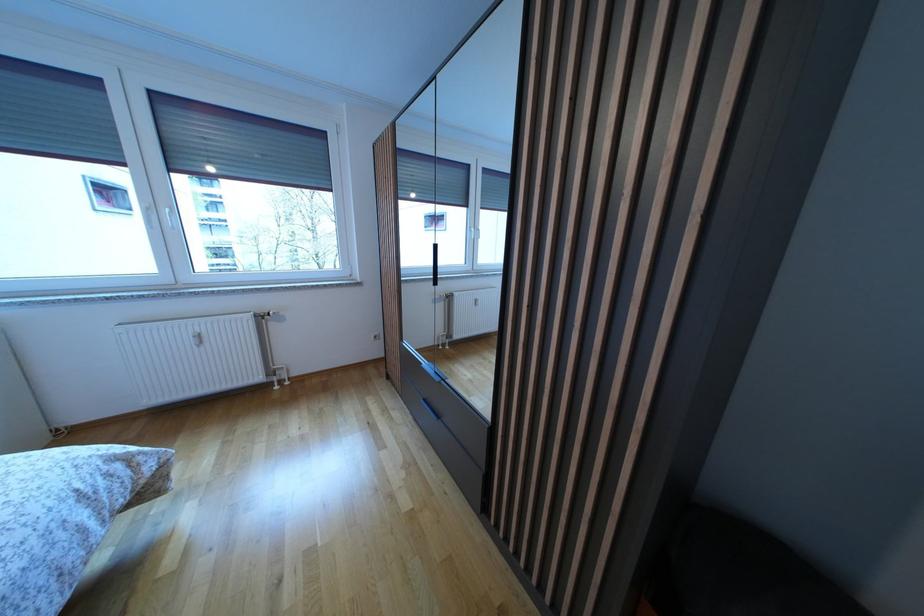
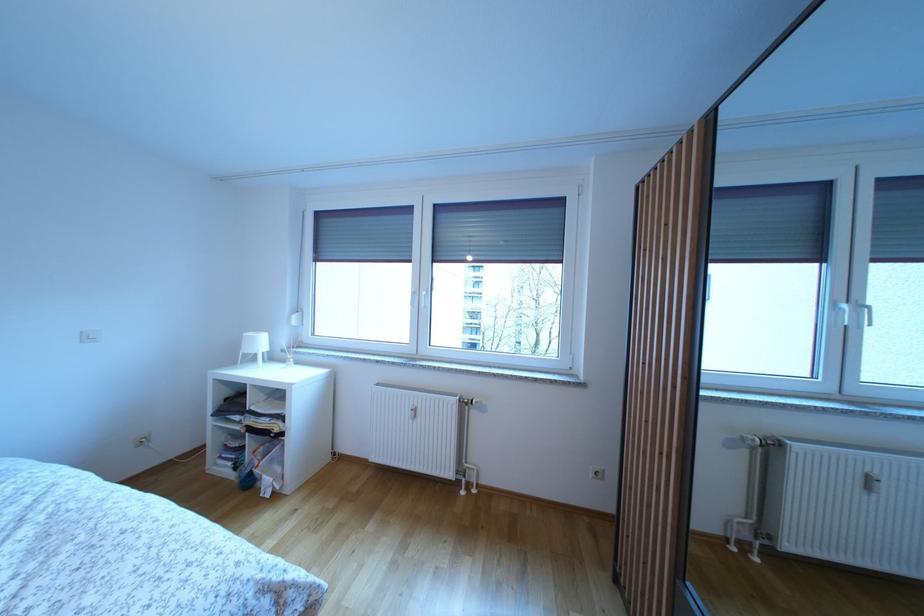
Question: Based on the continuous images, in which direction is the camera rotating? Reply with the corresponding letter.

Choices:
 (A) Left
 (B) Right
 (C) Up
 (D) Down

Answer: (A)